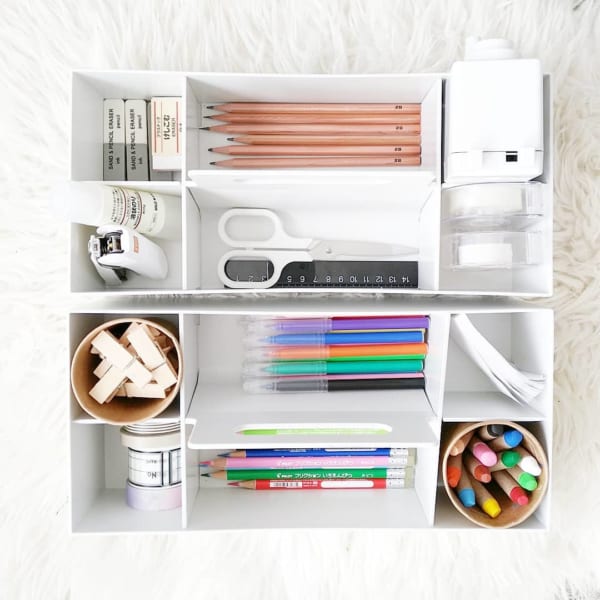
Identify the location of markers. (347, 324), (345, 336), (342, 350), (342, 365), (345, 376), (344, 385), (359, 358).